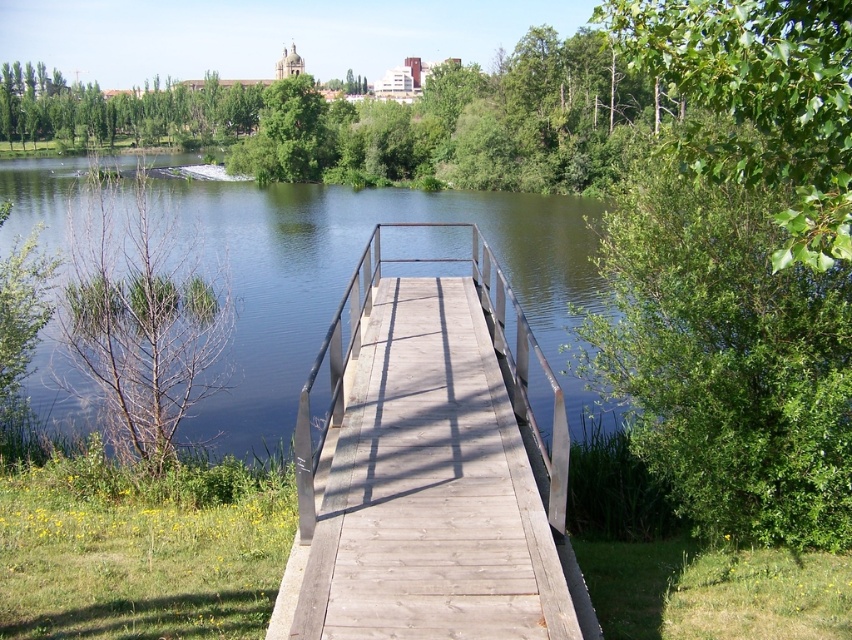
You are standing at the origin point of the coordinate system in this scene. You need to walk to the wooden dock at center. Which direction should you move in to reach it?

Since the wooden dock at center is located at coordinate point 0.733 on the x axis and 0.507 on the y axis, you should move towards the right direction along the x axis to reach it from the origin point.

You are standing on the wooden dock at center and want to reach the dark brown water at center. Which direction should you move to get closer to the water?

The wooden dock at center is shorter than the dark brown water at center, so you should move forward along the dock towards the water to get closer.

You are planning to walk across the wooden dock at center and need to know if it is narrow enough to avoid the dark brown water at center. Can you confirm the dock is narrower than the water?

The wooden dock at center is narrower than the dark brown water at center, so yes, it is narrow enough to avoid the water.